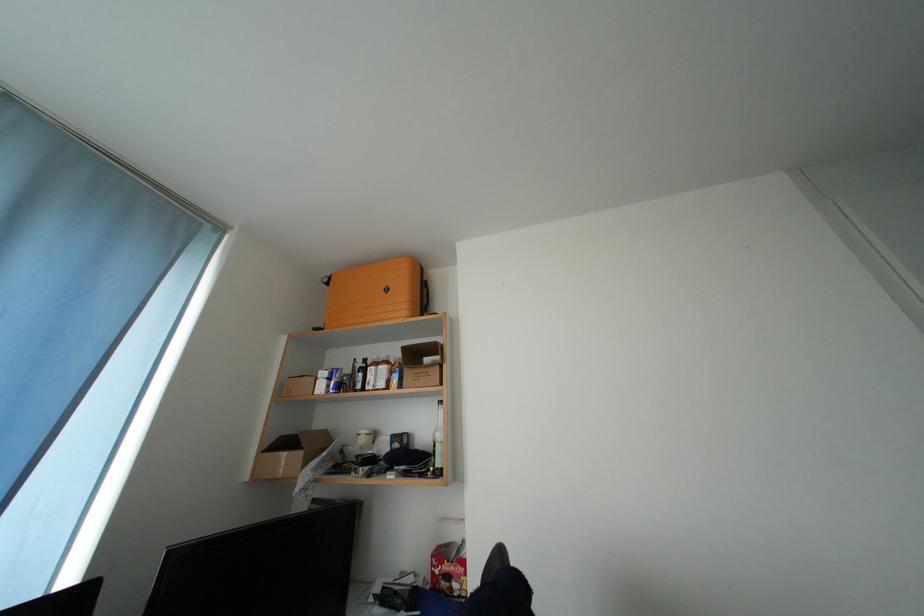
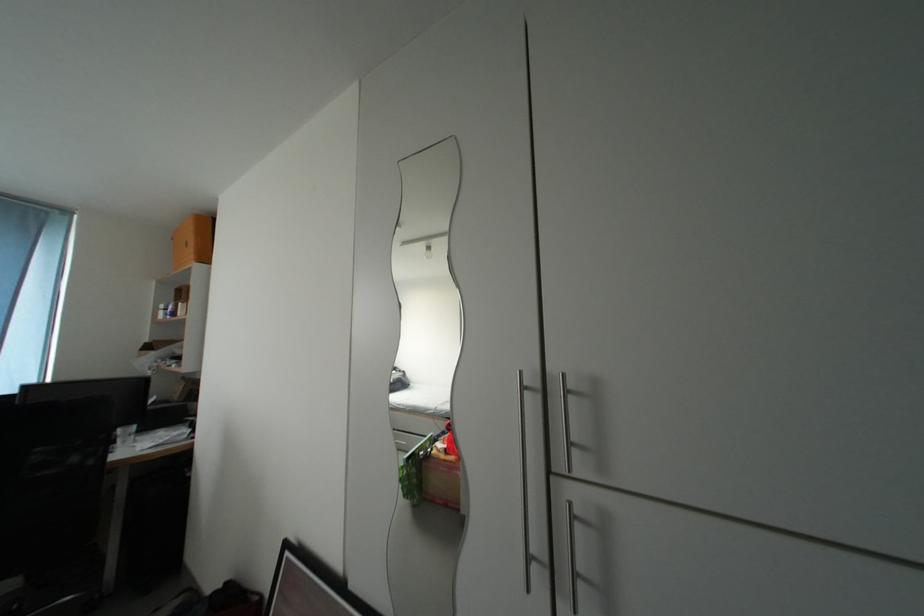
Question: What movement of the cameraman would produce the second image?

Choices:
 (A) Left
 (B) Right
 (C) Forward
 (D) Backward

Answer: (B)